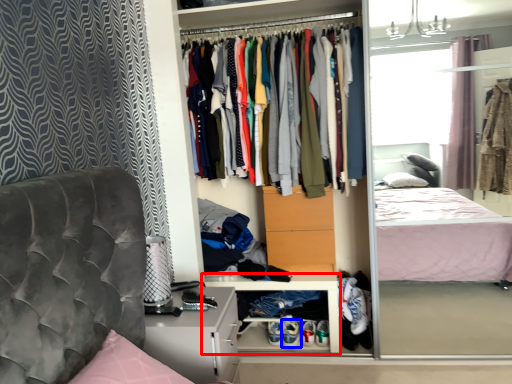
Question: Which object appears closest to the camera in this image, cabinet (highlighted by a red box) or footwear (highlighted by a blue box)?

Choices:
 (A) cabinet
 (B) footwear

Answer: (A)